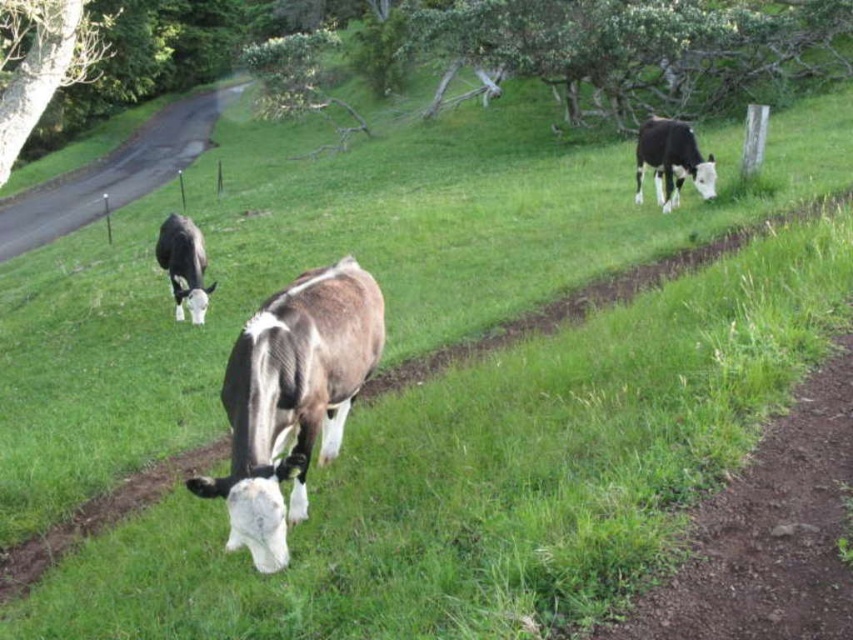
Question: From the image, what is the correct spatial relationship of brown glossy cow at center in relation to white and black cow at upper right?

Choices:
 (A) above
 (B) below

Answer: (B)

Question: Can you confirm if brown glossy cow at center is thinner than white and brown cow at center?

Choices:
 (A) no
 (B) yes

Answer: (B)

Question: Considering the real-world distances, which object is closest to the brown glossy cow at center?

Choices:
 (A) white and brown cow at center
 (B) asphalt road at left

Answer: (A)

Question: Considering the real-world distances, which object is closest to the white and black cow at upper right?

Choices:
 (A) asphalt road at left
 (B) white and brown cow at center

Answer: (B)

Question: Which object is closer to the camera taking this photo?

Choices:
 (A) white and brown cow at center
 (B) white and black cow at upper right
 (C) brown glossy cow at center

Answer: (C)

Question: Is the position of brown glossy cow at center more distant than that of white and black cow at upper right?

Choices:
 (A) no
 (B) yes

Answer: (A)